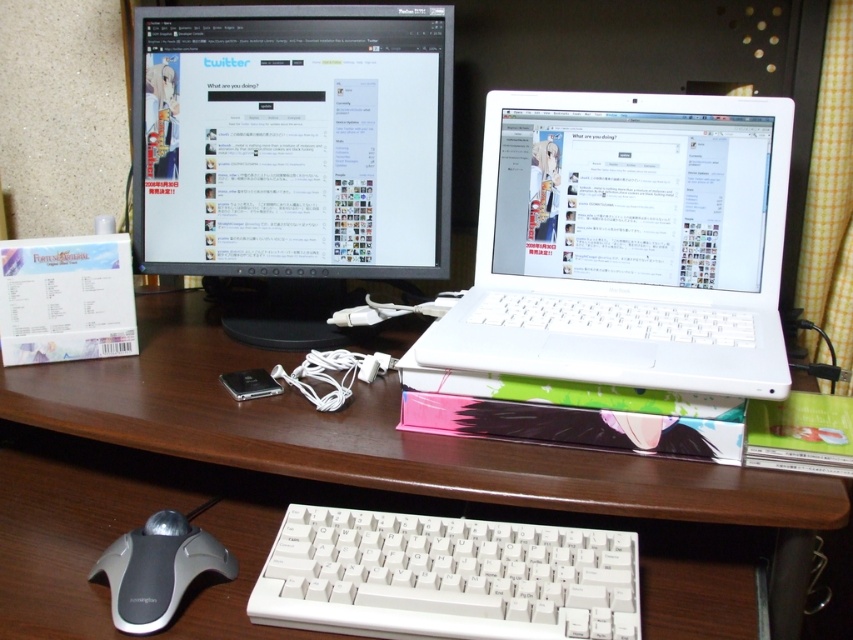
Between matte black monitor at upper left and white wood computer desk at center, which one is positioned higher?

matte black monitor at upper left is above.

Does matte black monitor at upper left have a lesser height compared to white wood computer desk at center?

Incorrect, matte black monitor at upper left's height does not fall short of white wood computer desk at center's.

Image resolution: width=853 pixels, height=640 pixels. In order to click on matte black monitor at upper left in this screenshot , I will do `click(291, 154)`.

Does white plastic laptop at center appear on the left side of matte black monitor at upper left?

Incorrect, white plastic laptop at center is not on the left side of matte black monitor at upper left.

You are a GUI agent. You are given a task and a screenshot of the screen. Output one action in this format:
    pyautogui.click(x=<x>, y=<y>)
    Task: Click on the white plastic laptop at center
    
    Given the screenshot: What is the action you would take?
    pyautogui.click(x=627, y=243)

Between point (492, 272) and point (199, 179), which one is positioned in front?

Point (492, 272)

At what (x,y) coordinates should I click in order to perform the action: click on white plastic laptop at center. Please return your answer as a coordinate pair (x, y). Looking at the image, I should click on (627, 243).

Who is more forward, (421, 529) or (146, 596)?

Point (146, 596) is more forward.

Is white plastic keyboard at center shorter than gray rubberized mouse at lower left?

In fact, white plastic keyboard at center may be taller than gray rubberized mouse at lower left.

I want to click on white plastic keyboard at center, so click(x=445, y=577).